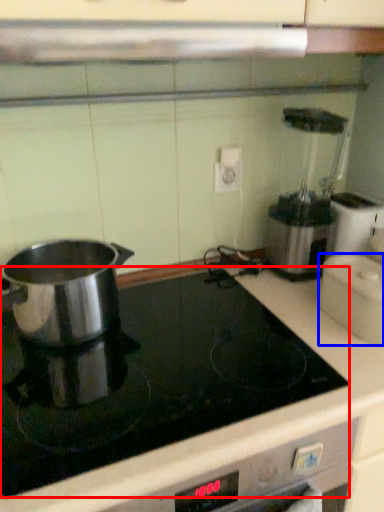
Question: Among these objects, which one is nearest to the camera, kitchen appliance (highlighted by a red box) or kitchen appliance (highlighted by a blue box)?

Choices:
 (A) kitchen appliance
 (B) kitchen appliance

Answer: (A)